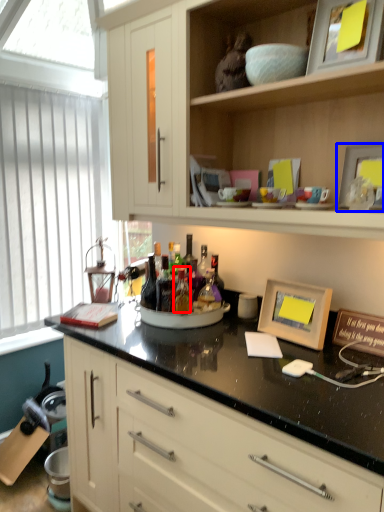
Question: Among these objects, which one is nearest to the camera, bottle (highlighted by a red box) or picture frame (highlighted by a blue box)?

Choices:
 (A) bottle
 (B) picture frame

Answer: (B)